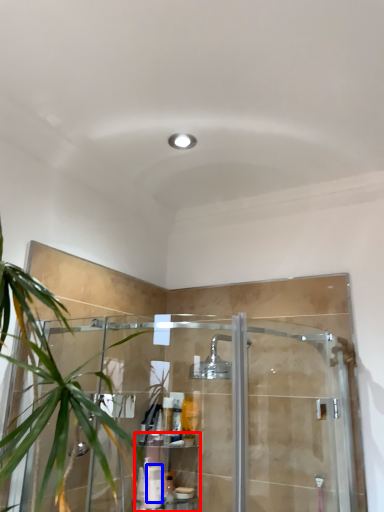
Question: Which object is further to the camera taking this photo, shelf (highlighted by a red box) or toiletry (highlighted by a blue box)?

Choices:
 (A) shelf
 (B) toiletry

Answer: (B)